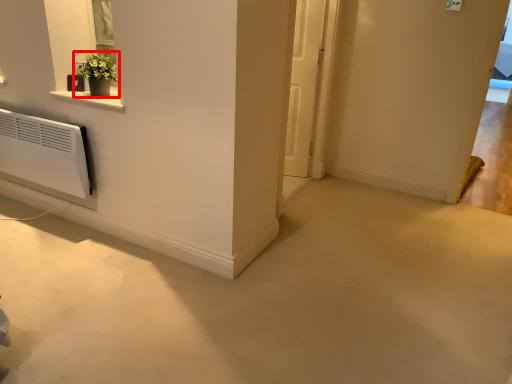
Question: From the image's perspective, where is houseplant (annotated by the red box) located relative to door?

Choices:
 (A) above
 (B) below

Answer: (B)